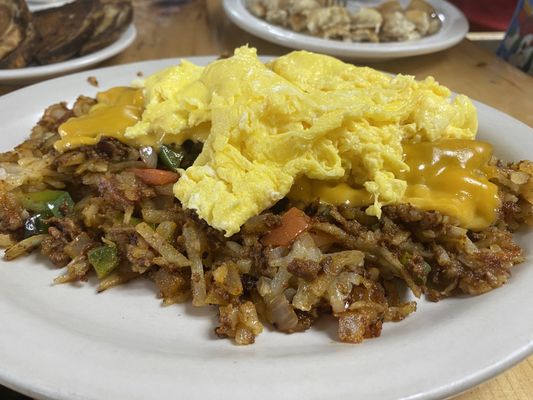
Locate an element on the screen. This screenshot has height=400, width=533. fork is located at coordinates (343, 3).